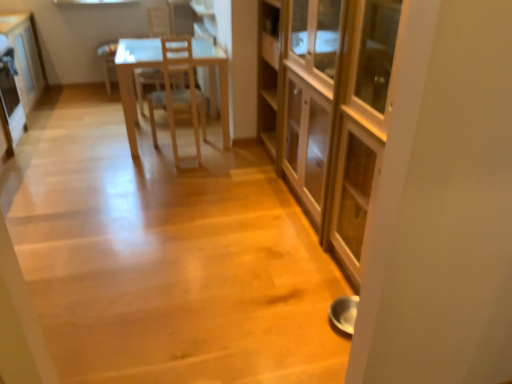
Question: Looking at their shapes, would you say metallic refrigerator at left is wider or thinner than wooden chair at center?

Choices:
 (A) thin
 (B) wide

Answer: (A)

Question: In terms of height, does metallic refrigerator at left look taller or shorter compared to wooden chair at center?

Choices:
 (A) short
 (B) tall

Answer: (A)

Question: Which is nearer to the wooden chair at center?

Choices:
 (A) white glossy cabinet at upper left, the 2th cabinetry from the front
 (B) light brown wooden chair at center
 (C) metallic refrigerator at left
 (D) matte wooden cabinet at center, marked as the 1th cabinetry in a front-to-back arrangement

Answer: (B)

Question: Considering the real-world distances, which object is closest to the metallic refrigerator at left?

Choices:
 (A) matte wooden cabinet at center, marked as the 1th cabinetry in a front-to-back arrangement
 (B) light brown wooden chair at center
 (C) white glossy cabinet at upper left, the 2th cabinetry from the front
 (D) wooden chair at center

Answer: (C)